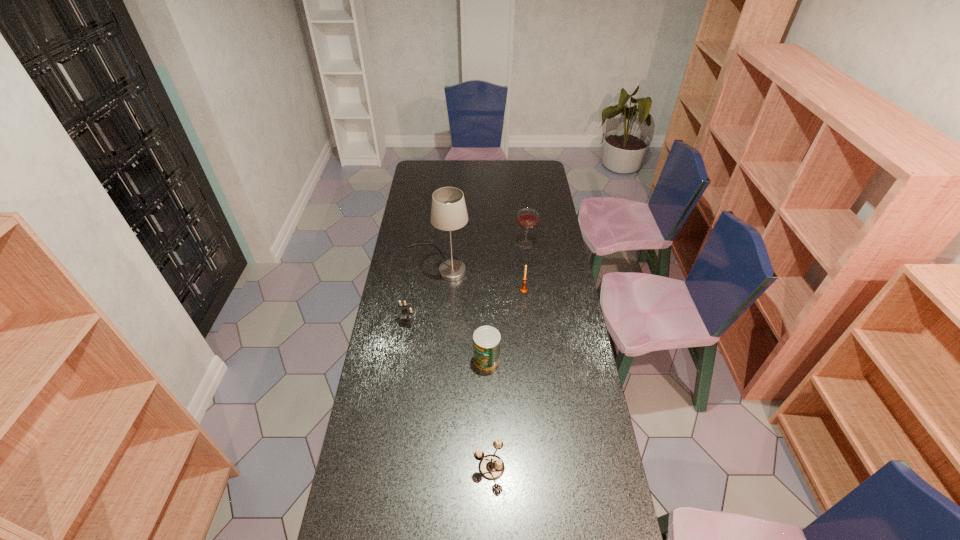
Locate an element on the screen. The width and height of the screenshot is (960, 540). vacant space located on the back of the second tallest object is located at coordinates (524, 229).

Identify the location of blank area located 0.230m on the back of the farthest candle holder. (520, 253).

This screenshot has width=960, height=540. What are the coordinates of `free region located on the back of the second nearest object` in the screenshot? It's located at [x=486, y=282].

Where is `vacant space located 0.230m on the front of the third nearest object`? vacant space located 0.230m on the front of the third nearest object is located at coordinates (400, 376).

Find the location of `vacant space located on the left of the nearest candle holder`. vacant space located on the left of the nearest candle holder is located at coordinates (442, 467).

Find the location of a particular element. The width and height of the screenshot is (960, 540). table lamp that is at the left edge is located at coordinates (448, 211).

Identify the location of candle holder at the left edge. (406, 311).

Where is `object that is at the right edge`? This screenshot has width=960, height=540. object that is at the right edge is located at coordinates (527, 219).

Find the location of `free space at the left edge`. free space at the left edge is located at coordinates (419, 210).

You are a GUI agent. You are given a task and a screenshot of the screen. Output one action in this format:
    pyautogui.click(x=<x>, y=<y>)
    Task: Click on the free spot at the right edge of the desktop
    Image resolution: width=960 pixels, height=540 pixels.
    Given the screenshot: What is the action you would take?
    pyautogui.click(x=576, y=304)